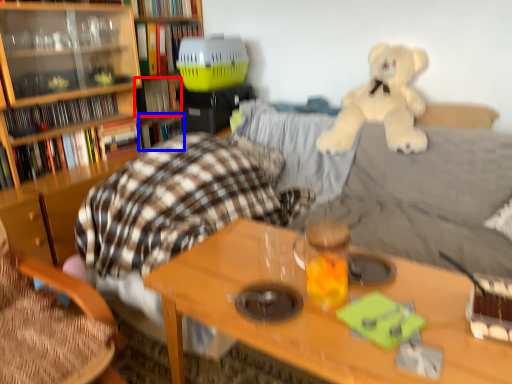
Question: Which object is further to the camera taking this photo, book (highlighted by a red box) or book (highlighted by a blue box)?

Choices:
 (A) book
 (B) book

Answer: (B)